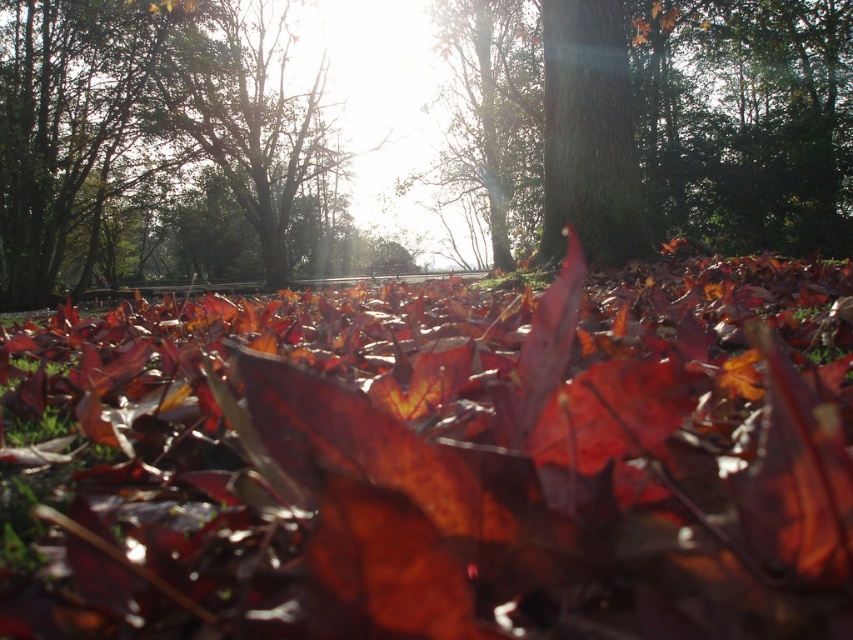
Question: Which of the following is the closest to the observer?

Choices:
 (A) (309, 426)
 (B) (572, 220)
 (C) (605, 65)

Answer: (A)

Question: Can you confirm if shiny red leaves at center is wider than green rough bark tree at center?

Choices:
 (A) no
 (B) yes

Answer: (B)

Question: Which is farther from the shiny red leaves at center?

Choices:
 (A) green rough bark tree at center
 (B) smooth bark tree at center

Answer: (B)

Question: Is shiny red leaves at center to the right of smooth bark tree at center from the viewer's perspective?

Choices:
 (A) yes
 (B) no

Answer: (B)

Question: Is shiny red leaves at center to the left of smooth bark tree at center from the viewer's perspective?

Choices:
 (A) yes
 (B) no

Answer: (A)

Question: Which point is closer to the camera taking this photo?

Choices:
 (A) (780, 195)
 (B) (560, 112)
 (C) (404, 577)

Answer: (C)